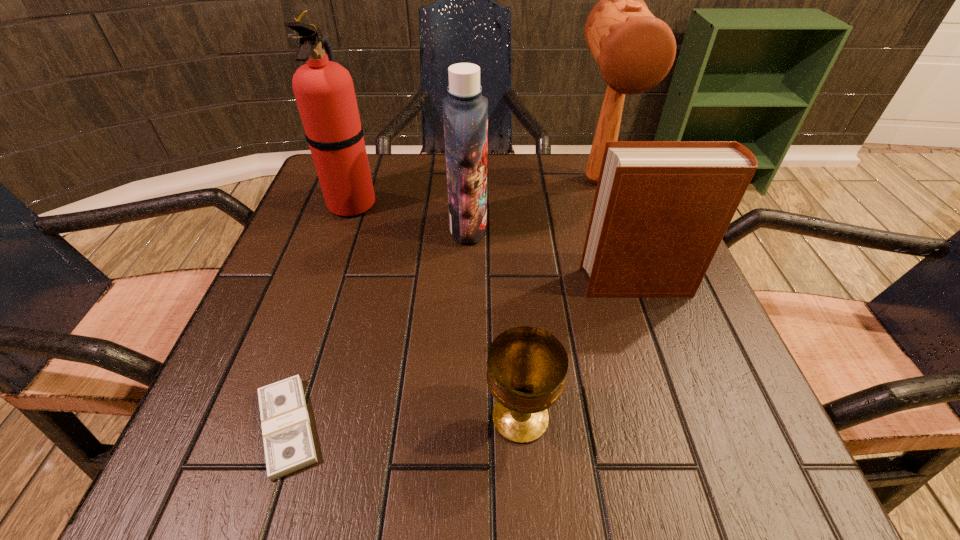
Where is `fire extinguisher at the left edge`? This screenshot has height=540, width=960. fire extinguisher at the left edge is located at coordinates (324, 91).

Where is `dollar that is positioned at the left edge`? dollar that is positioned at the left edge is located at coordinates (288, 443).

At what (x,y) coordinates should I click in order to perform the action: click on mallet that is at the right edge. Please return your answer as a coordinate pair (x, y). Looking at the image, I should click on (634, 51).

The height and width of the screenshot is (540, 960). I want to click on hardback book that is at the right edge, so click(x=661, y=208).

The width and height of the screenshot is (960, 540). I want to click on object that is at the far left corner, so click(x=324, y=91).

Find the location of `object that is at the near left corner`. object that is at the near left corner is located at coordinates (288, 443).

Find the location of `object at the far right corner`. object at the far right corner is located at coordinates point(634,51).

Locate an element on the screen. Image resolution: width=960 pixels, height=540 pixels. free space at the far edge of the desktop is located at coordinates (437, 209).

Image resolution: width=960 pixels, height=540 pixels. In the image, there is a desktop. In order to click on free space at the near edge in this screenshot , I will do `click(588, 478)`.

Locate an element on the screen. vacant space at the left edge of the desktop is located at coordinates coord(306,380).